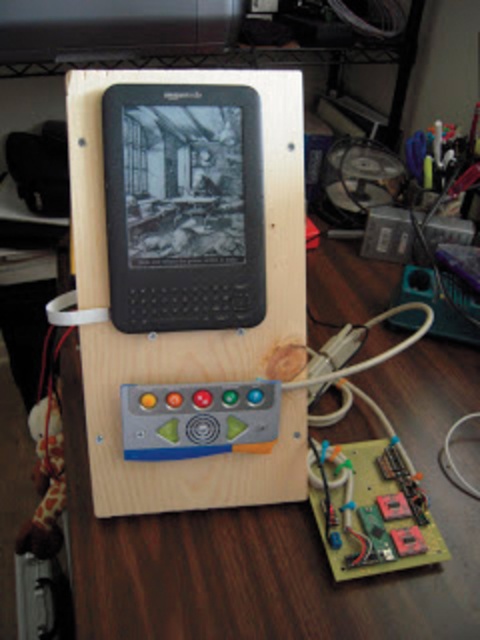
You are an engineer inspecting the circuit board and need to adjust a component closer to you. Which point, point (x=456, y=449) or point (x=420, y=547), is closer to you?

Point (x=456, y=449) is further to the viewer than point (x=420, y=547), so point (x=456, y=449) is closer to you.